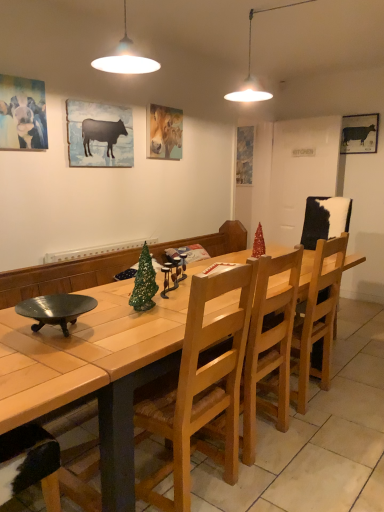
This screenshot has width=384, height=512. I want to click on free area in between wooden chair at center, arranged as the 2th chair when viewed from the left, and wooden table at center, so click(298, 421).